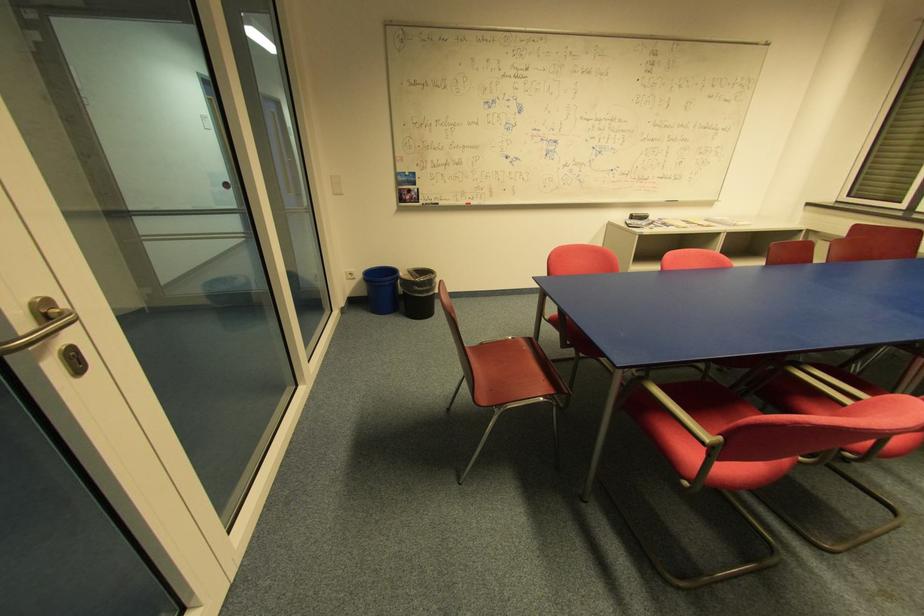
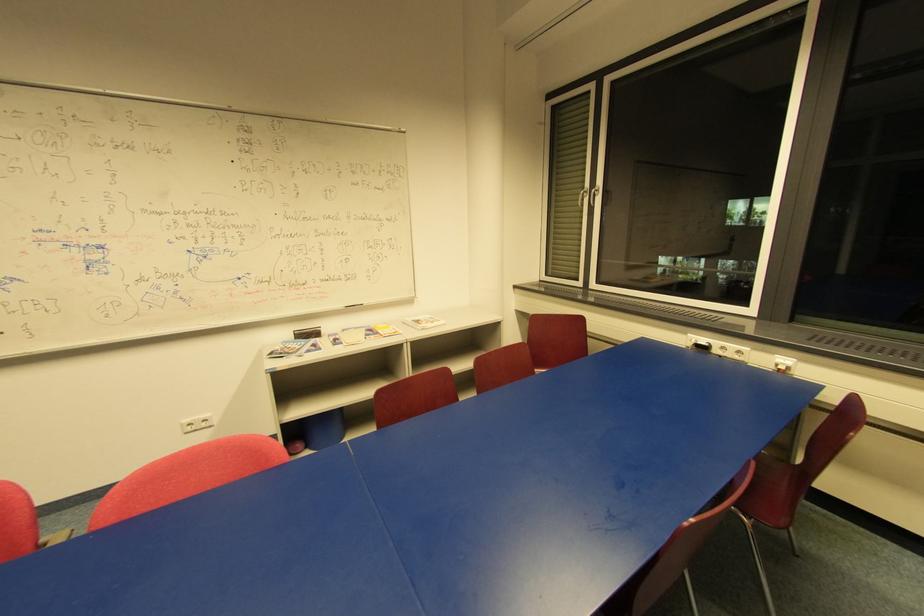
In the second image, find the point that corresponds to (x=665, y=201) in the first image.

(344, 307)